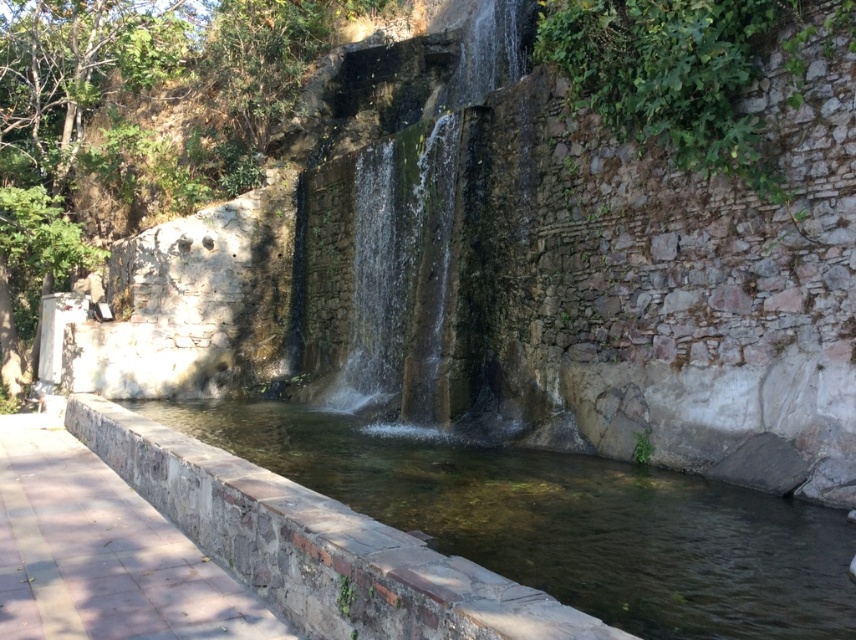
From the picture: You are standing on the paved walkway on the left and want to cross to the other side. The clear stone stream at center and smooth stone waterfall at center are in your path. Which one should you step over first?

You should step over the clear stone stream at center first because it is located below the smooth stone waterfall at center, meaning the stream is closer to the walkway on the left.

You are a hiker carrying a heavy backpack and need to cross the clear stone stream at center. The smooth stone waterfall at center is nearby. Can you safely cross the stream without getting your backpack wet? Please explain your reasoning based on the distance between them.

The clear stone stream at center is 23.93 feet away from the smooth stone waterfall at center. Since the stream is relatively close to the waterfall, the water flow might be stronger and deeper near the waterfall, making it risky to cross with a heavy backpack. It is advisable to find a safer crossing point further away from the waterfall.

You are standing on the paved walkway on the left and want to cross to the other side. The clear stone stream at center and smooth stone waterfall at center are in your path. Which one should you step over first?

You should step over the smooth stone waterfall at center first because the clear stone stream at center is to its right, meaning the waterfall is closer to your current position on the left walkway.